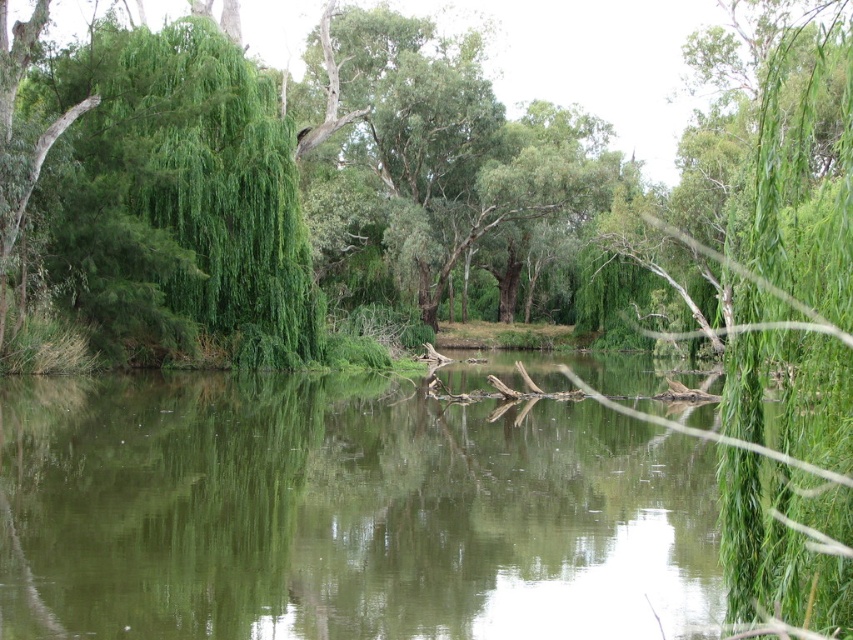
Is green reflective water at center below green leafy willow at left?

Correct, green reflective water at center is located below green leafy willow at left.

Describe the element at coordinates (344, 513) in the screenshot. I see `green reflective water at center` at that location.

At what (x,y) coordinates should I click in order to perform the action: click on green reflective water at center. Please return your answer as a coordinate pair (x, y). The width and height of the screenshot is (853, 640). Looking at the image, I should click on (344, 513).

Which of these two, green reflective water at center or green leafy tree at center, stands taller?

green leafy tree at center

Who is positioned more to the right, green reflective water at center or green leafy tree at center?

green leafy tree at center

Is point (529, 509) closer to camera compared to point (552, 214)?

Yes, it is.

Image resolution: width=853 pixels, height=640 pixels. Identify the location of green reflective water at center. (344, 513).

Who is lower down, green leafy tree at center or green leafy willow at left?

green leafy willow at left is below.

Can you confirm if green leafy tree at center is wider than green leafy willow at left?

Yes, green leafy tree at center is wider than green leafy willow at left.

This screenshot has width=853, height=640. Find the location of `green leafy tree at center`. green leafy tree at center is located at coordinates (274, 176).

Where is `green leafy tree at center`? green leafy tree at center is located at coordinates (274, 176).